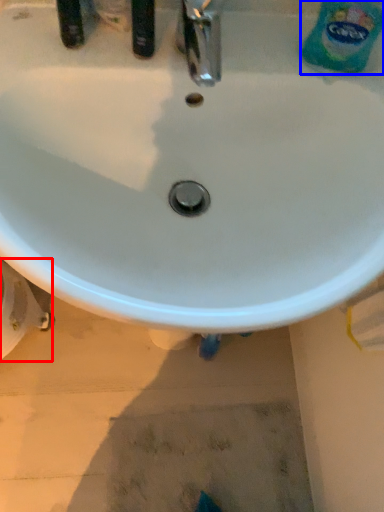
Question: Which of the following is the closest to the observer, bidet (highlighted by a red box) or cleaning product (highlighted by a blue box)?

Choices:
 (A) bidet
 (B) cleaning product

Answer: (B)